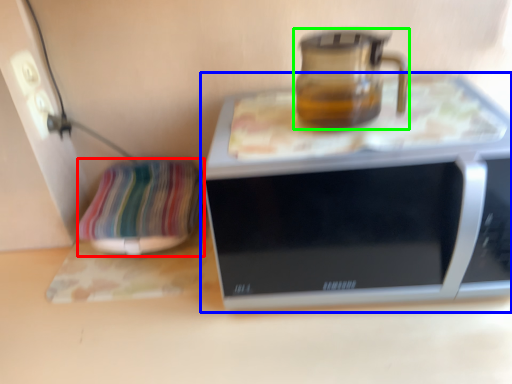
Question: Based on their relative distances, which object is nearer to pillow (highlighted by a red box)? Choose from microwave oven (highlighted by a blue box) and jug (highlighted by a green box).

Choices:
 (A) microwave oven
 (B) jug

Answer: (A)